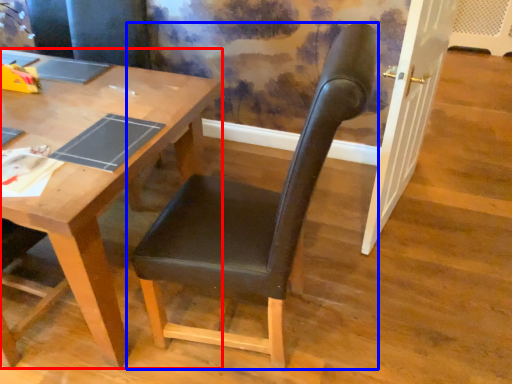
Question: Which point is closer to the camera, desk (highlighted by a red box) or chair (highlighted by a blue box)?

Choices:
 (A) desk
 (B) chair

Answer: (B)